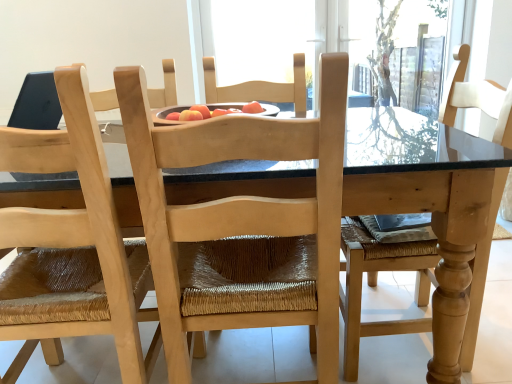
Measure the distance between point (222,348) and camera.

They are 1.52 meters apart.

At what (x,y) coordinates should I click in order to perform the action: click on natural wood chair at center, the first chair when ordered from right to left. Please return your answer as a coordinate pair (x, y). Looking at the image, I should click on click(242, 223).

Is natural wood chair at center, the first chair when ordered from right to left, surrounding natural wood chair at center, the second chair in the right-to-left sequence?

No, natural wood chair at center, the second chair in the right-to-left sequence, is not surrounded by natural wood chair at center, the first chair when ordered from right to left.

Is natural wood chair at center, the first chair when ordered from right to left, next to natural wood chair at center, the second chair in the right-to-left sequence, and touching it?

No, natural wood chair at center, the first chair when ordered from right to left, is not making contact with natural wood chair at center, the second chair in the right-to-left sequence.

Who is more distant, natural wood chair at center, the first chair when ordered from right to left, or natural wood chair at center, the second chair in the right-to-left sequence?

natural wood chair at center, the first chair when ordered from right to left.

Is natural wood table at center to the right of natural wood chair at center, which appears as the second chair when viewed from the left, from the viewer's perspective?

In fact, natural wood table at center is to the left of natural wood chair at center, which appears as the second chair when viewed from the left.

Which of these two, natural wood table at center or natural wood chair at center, the first chair when ordered from right to left, is wider?

Wider between the two is natural wood table at center.

Where is `kitchen & dining room table behind the natural wood chair at center, which appears as the second chair when viewed from the left`? This screenshot has height=384, width=512. kitchen & dining room table behind the natural wood chair at center, which appears as the second chair when viewed from the left is located at coordinates (256, 356).

Considering the points (241, 222) and (118, 368), which point is in front, point (241, 222) or point (118, 368)?

The point (241, 222) is closer to the camera.

Could you measure the distance between natural wood chair at center, which appears as the second chair when viewed from the left, and natural wood table at center?

They are 50.81 centimeters apart.

Can you confirm if natural wood chair at center, the first chair when ordered from right to left, is taller than natural wood table at center?

Correct, natural wood chair at center, the first chair when ordered from right to left, is much taller as natural wood table at center.

You are a GUI agent. You are given a task and a screenshot of the screen. Output one action in this format:
    pyautogui.click(x=<x>, y=<y>)
    Task: Click on the kitchen & dining room table on the left side of natural wood chair at center, the first chair when ordered from right to left
    
    Given the screenshot: What is the action you would take?
    pyautogui.click(x=256, y=356)

You are a GUI agent. You are given a task and a screenshot of the screen. Output one action in this format:
    pyautogui.click(x=<x>, y=<y>)
    Task: Click on the chair that appears on the right of natural wood chair at center, the second chair in the right-to-left sequence
    Image resolution: width=512 pixels, height=384 pixels.
    Given the screenshot: What is the action you would take?
    pyautogui.click(x=242, y=223)

From the image's perspective, is natural wood chair at center, which is the 1th chair in left-to-right order, located above or below natural wood chair at center, the first chair when ordered from right to left?

natural wood chair at center, which is the 1th chair in left-to-right order, is situated lower than natural wood chair at center, the first chair when ordered from right to left, in the image.

What's the angular difference between natural wood chair at center, which is the 1th chair in left-to-right order, and natural wood chair at center, the first chair when ordered from right to left,'s facing directions?

There is a 1.54-degree angle between the facing directions of natural wood chair at center, which is the 1th chair in left-to-right order, and natural wood chair at center, the first chair when ordered from right to left.

Is natural wood chair at center, which is the 1th chair in left-to-right order, touching natural wood chair at center, the first chair when ordered from right to left?

No, natural wood chair at center, which is the 1th chair in left-to-right order, is not making contact with natural wood chair at center, the first chair when ordered from right to left.

Can you confirm if natural wood table at center is taller than natural wood chair at center, which is the 1th chair in left-to-right order?

No, natural wood table at center is not taller than natural wood chair at center, which is the 1th chair in left-to-right order.

Is natural wood table at center turned away from natural wood chair at center, which is the 1th chair in left-to-right order?

natural wood table at center does not have its back to natural wood chair at center, which is the 1th chair in left-to-right order.

Considering the sizes of objects natural wood table at center and natural wood chair at center, which is the 1th chair in left-to-right order, in the image provided, who is smaller, natural wood table at center or natural wood chair at center, which is the 1th chair in left-to-right order,?

Smaller between the two is natural wood chair at center, which is the 1th chair in left-to-right order.

Considering the sizes of objects natural wood chair at center, the second chair in the right-to-left sequence, and natural wood table at center in the image provided, who is thinner, natural wood chair at center, the second chair in the right-to-left sequence, or natural wood table at center?

Thinner between the two is natural wood chair at center, the second chair in the right-to-left sequence.

Are natural wood chair at center, which is the 1th chair in left-to-right order, and natural wood table at center making contact?

There is a gap between natural wood chair at center, which is the 1th chair in left-to-right order, and natural wood table at center.

Which is behind, point (114, 303) or point (264, 359)?

Positioned behind is point (264, 359).

What's the angular difference between natural wood chair at center, the second chair in the right-to-left sequence, and natural wood table at center's facing directions?

The angular difference between natural wood chair at center, the second chair in the right-to-left sequence, and natural wood table at center is 88 degrees.

At what (x,y) coordinates should I click in order to perform the action: click on chair on the left of natural wood chair at center, the first chair when ordered from right to left. Please return your answer as a coordinate pair (x, y). The image size is (512, 384). Looking at the image, I should click on (72, 247).

In order to click on the 2nd chair above the natural wood table at center (from a real-world perspective) in this screenshot , I will do `click(242, 223)`.

From the image, which object appears to be nearer to natural wood table at center, natural wood chair at center, the second chair in the right-to-left sequence, or natural wood chair at center, which appears as the second chair when viewed from the left?

Based on the image, natural wood chair at center, the second chair in the right-to-left sequence, appears to be nearer to natural wood table at center.

Based on their spatial positions, is natural wood chair at center, the second chair in the right-to-left sequence, or natural wood table at center further from natural wood chair at center, which appears as the second chair when viewed from the left?

natural wood table at center is further to natural wood chair at center, which appears as the second chair when viewed from the left.

Considering their positions, is natural wood chair at center, which appears as the second chair when viewed from the left, positioned closer to natural wood chair at center, which is the 1th chair in left-to-right order, than natural wood table at center?

natural wood chair at center, which appears as the second chair when viewed from the left, is positioned closer to the anchor natural wood chair at center, which is the 1th chair in left-to-right order.

Which object lies further to the anchor point natural wood table at center, natural wood chair at center, the first chair when ordered from right to left, or natural wood chair at center, the second chair in the right-to-left sequence?

natural wood chair at center, the first chair when ordered from right to left.

Considering their positions, is natural wood table at center positioned closer to natural wood chair at center, the first chair when ordered from right to left, than natural wood chair at center, the second chair in the right-to-left sequence?

natural wood chair at center, the second chair in the right-to-left sequence, is positioned closer to the anchor natural wood chair at center, the first chair when ordered from right to left.

From the image, which object appears to be farther from natural wood chair at center, which is the 1th chair in left-to-right order, natural wood table at center or natural wood chair at center, the first chair when ordered from right to left?

natural wood table at center is positioned further to the anchor natural wood chair at center, which is the 1th chair in left-to-right order.

Where is `kitchen & dining room table between natural wood chair at center, the second chair in the right-to-left sequence, and natural wood chair at center, which appears as the second chair when viewed from the left`? This screenshot has width=512, height=384. kitchen & dining room table between natural wood chair at center, the second chair in the right-to-left sequence, and natural wood chair at center, which appears as the second chair when viewed from the left is located at coordinates (256, 356).